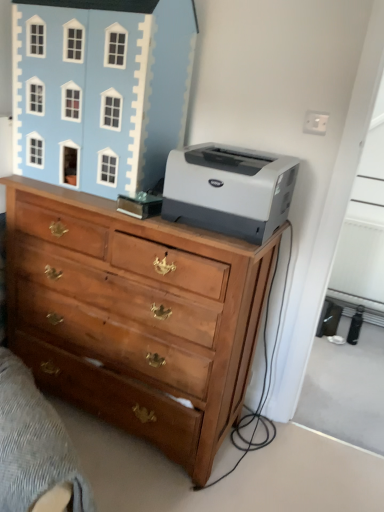
Question: From the image's perspective, relative to wooden chest of drawers at center, is light blue painted wood dollhouse at upper left above or below?

Choices:
 (A) below
 (B) above

Answer: (B)

Question: Is light blue painted wood dollhouse at upper left in front of or behind wooden chest of drawers at center in the image?

Choices:
 (A) front
 (B) behind

Answer: (B)

Question: Which object is the farthest from the wooden drawer at lower left?

Choices:
 (A) light blue painted wood dollhouse at upper left
 (B) gray matte printer at upper right
 (C) wooden chest of drawers at center

Answer: (A)

Question: Considering the real-world distances, which object is farthest from the wooden chest of drawers at center?

Choices:
 (A) light blue painted wood dollhouse at upper left
 (B) gray matte printer at upper right
 (C) wooden drawer at lower left

Answer: (A)